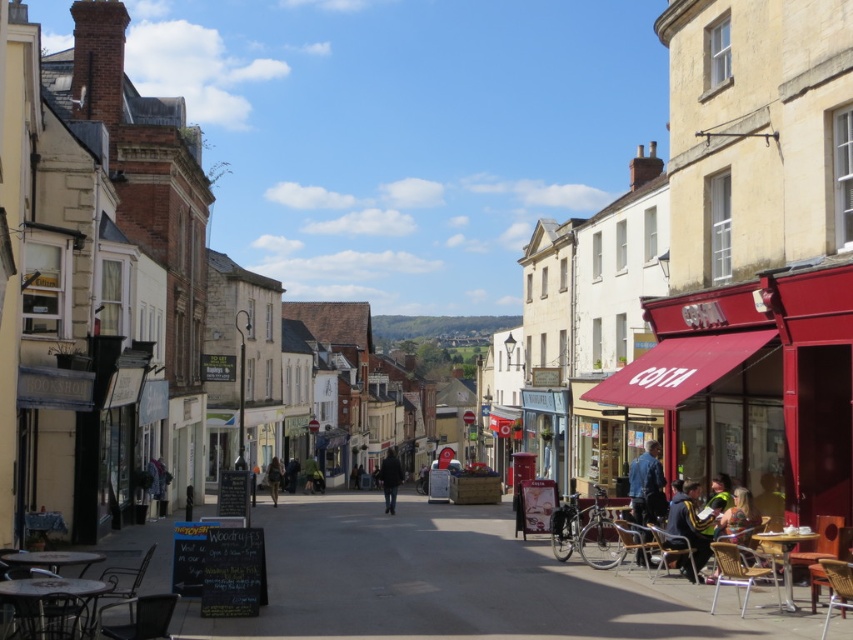
You are a tailor who needs to determine which jacket to alter first. You see a dark brown leather jacket at center and a dark blue jacket at center. Which jacket is taller?

The dark brown leather jacket at center is taller than the dark blue jacket at center.

You are a customer in the bookstore and see both the dark brown leather jacket at center and the dark blue jacket at center displayed on a rack. Which jacket takes up more space on the rack?

The dark brown leather jacket at center is bigger than the dark blue jacket at center, so it takes up more space on the rack.

You are a pedestrian standing at the edge of the street looking towards the shops. You see a dark blue jacket at lower right and a dark brown leather jacket at center. Which jacket is nearer to you?

The dark blue jacket at lower right is closer to the viewer than the dark brown leather jacket at center.